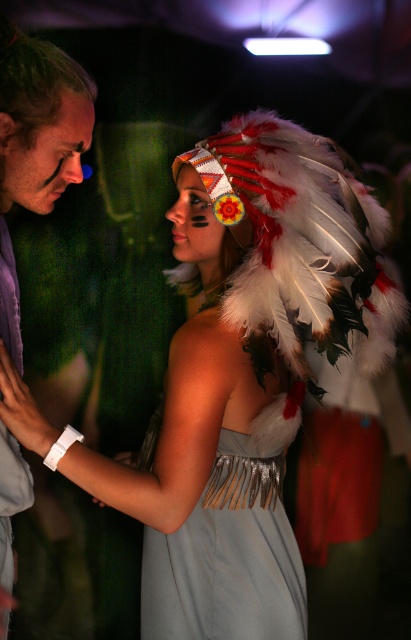
You are a photographer at a festival and want to capture a photo of the satin silver dress at center and the matte purple shirt at left. Based on their positions, which one should you focus on first if you want to include both in the frame without moving the camera?

The satin silver dress at center is located below the matte purple shirt at left, so you should focus on the matte purple shirt at left first to ensure both are in the frame without moving the camera.

You are a photographer at a festival. You need to capture a photo of the white feather headdress at upper center and the matte purple shirt at left. Since the background is crowded, you want to ensure both are fully visible. Which object should you adjust your camera angle to prioritize to avoid being blocked by the other?

The white feather headdress at upper center is not as tall as the matte purple shirt at left. Therefore, you should prioritize adjusting your camera angle to ensure the shorter white feather headdress at upper center is not blocked by the taller matte purple shirt at left.